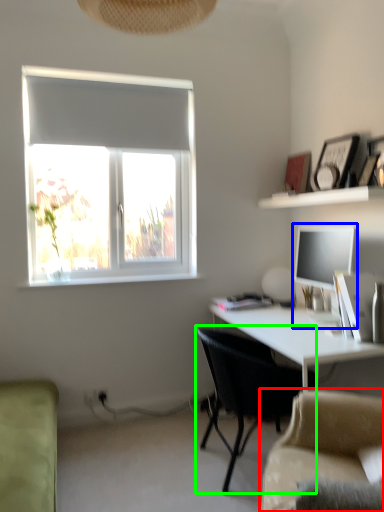
Question: Which is farther away from studio couch (highlighted by a red box)? desktop computer (highlighted by a blue box) or chair (highlighted by a green box)?

Choices:
 (A) desktop computer
 (B) chair

Answer: (A)